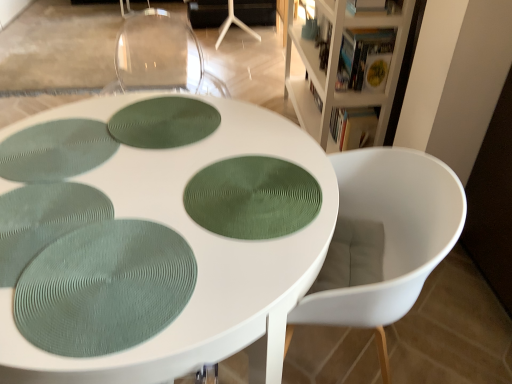
Locate an element on the screen. The image size is (512, 384). vacant area that is in front of green textured placemat at center, which is the 1th oval in back-to-front order is located at coordinates (141, 186).